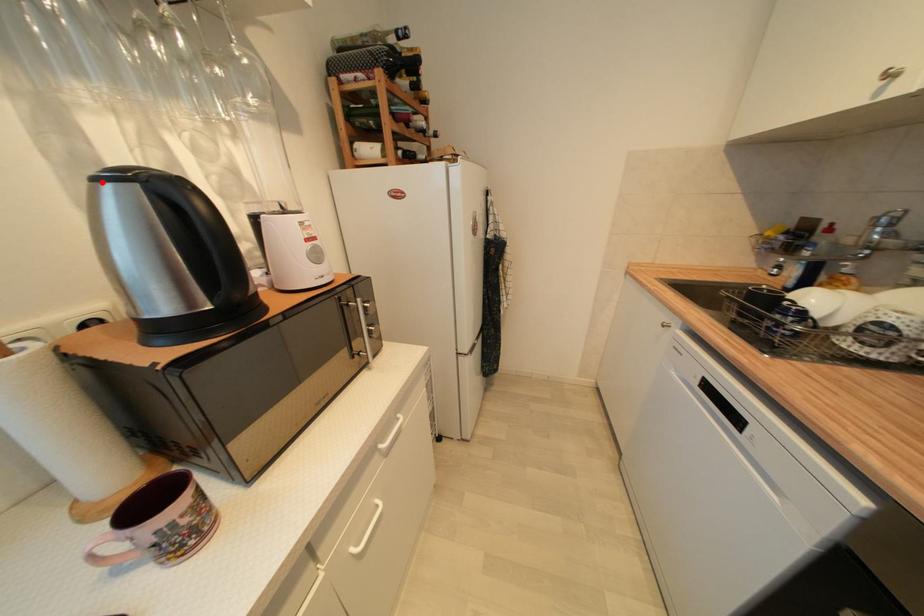
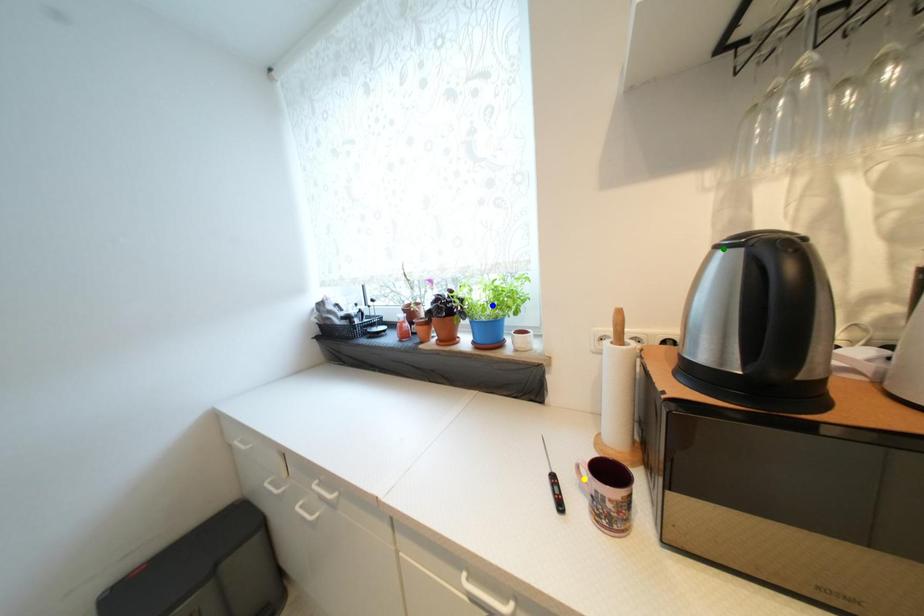
Question: I am providing you with two images of the same scene from different viewpoints. A red point is marked on the first image. You are given multiple points on the second image. Which point in image 2 is actually the same real-world point as the red point in image 1?

Choices:
 (A) green point
 (B) yellow point
 (C) blue point

Answer: (A)